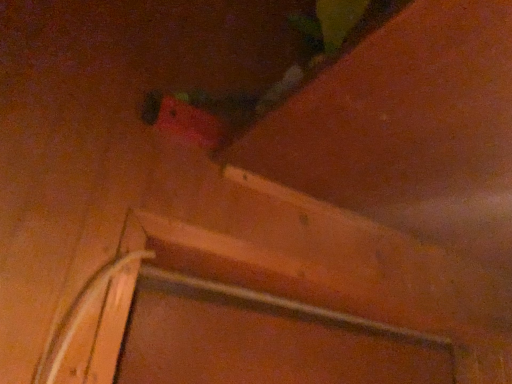
I want to click on shiny red woodpecker at center, so click(x=214, y=111).

This screenshot has height=384, width=512. Describe the element at coordinates (214, 111) in the screenshot. I see `shiny red woodpecker at center` at that location.

Identify the location of shiny red woodpecker at center. (214, 111).